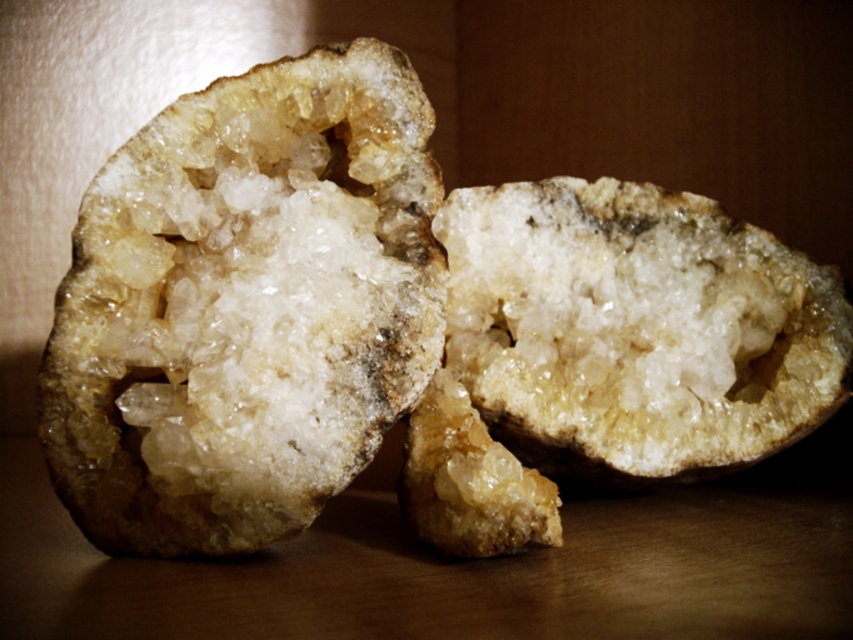
Which is above, translucent crystal rock at center or translucent crystal at center?

translucent crystal rock at center

Which is more to the right, translucent crystal rock at center or translucent crystal at center?

translucent crystal at center is more to the right.

I want to click on translucent crystal rock at center, so click(x=247, y=305).